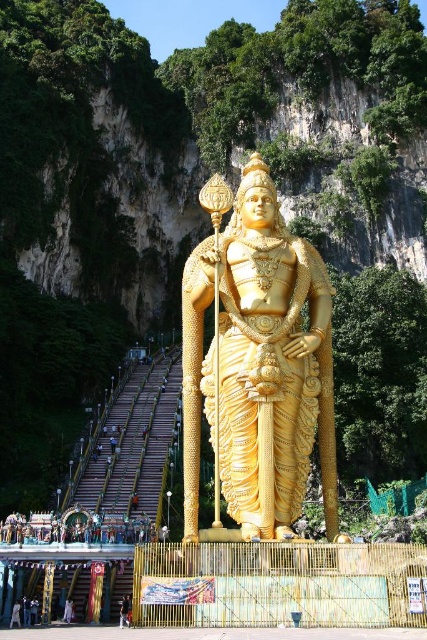
Does point (18, 625) come closer to viewer compared to point (69, 621)?

Yes, point (18, 625) is closer to viewer.

Who is higher up, light gray fabric person at lower left or light brown fabric pants at lower left?

light gray fabric person at lower left is higher up.

Identify the location of light gray fabric person at lower left. (15, 614).

Can you confirm if golden polished statue at center is positioned to the right of light gray fabric person at lower left?

Yes, golden polished statue at center is to the right of light gray fabric person at lower left.

Where is `golden polished statue at center`? golden polished statue at center is located at coordinates (259, 365).

Does point (128, 618) lie in front of point (18, 602)?

Yes, point (128, 618) is in front of point (18, 602).

Image resolution: width=427 pixels, height=640 pixels. I want to click on dark blue jeans at lower center, so click(x=125, y=611).